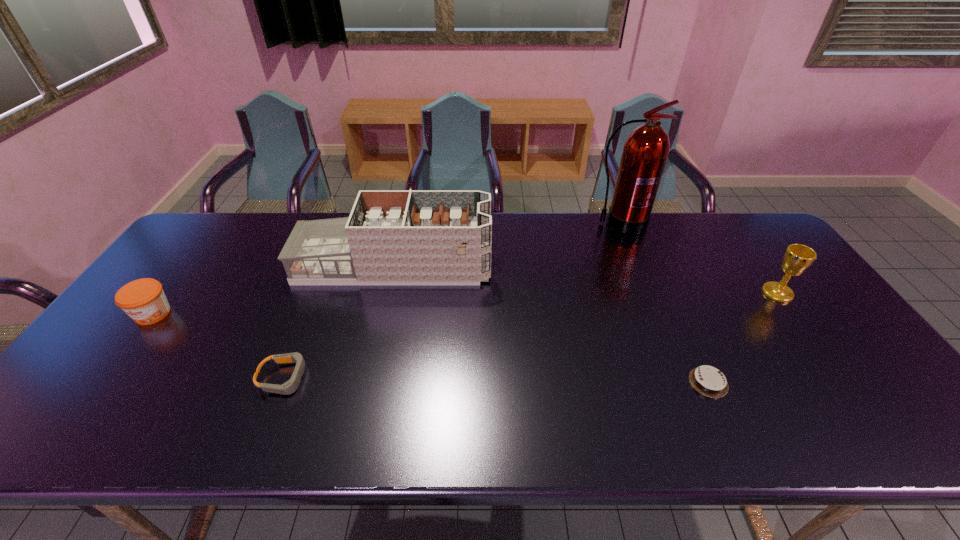
At what (x,y) coordinates should I click in order to perform the action: click on vacant space situated at the entrance of the dollhouse. Please return your answer as a coordinate pair (x, y). The height and width of the screenshot is (540, 960). Looking at the image, I should click on (581, 266).

You are a GUI agent. You are given a task and a screenshot of the screen. Output one action in this format:
    pyautogui.click(x=<x>, y=<y>)
    Task: Click on the vacant space located on the front of the fourth shortest object
    
    Given the screenshot: What is the action you would take?
    (x=879, y=435)

I want to click on blank area located 0.330m on the front label of the leftmost object, so click(x=53, y=447).

The image size is (960, 540). Identify the location of vacant space situated 0.090m on the front and back of the goggles. (347, 378).

Find the location of a particular element. The width and height of the screenshot is (960, 540). vacant space located on the right of the chocolate cake is located at coordinates (811, 382).

Image resolution: width=960 pixels, height=540 pixels. Identify the location of fire extinguisher positioned at the far edge. (646, 150).

I want to click on dollhouse that is at the far edge, so click(x=392, y=237).

Locate an element on the screen. Image resolution: width=960 pixels, height=540 pixels. object positioned at the left edge is located at coordinates (143, 300).

Identify the location of object that is at the right edge. This screenshot has height=540, width=960. (797, 258).

The width and height of the screenshot is (960, 540). Find the location of `vacant area at the far edge of the desktop`. vacant area at the far edge of the desktop is located at coordinates (699, 227).